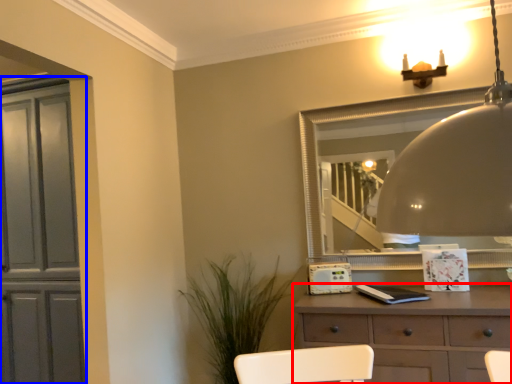
Question: Which object is closer to the camera taking this photo, chest of drawers (highlighted by a red box) or cabinetry (highlighted by a blue box)?

Choices:
 (A) chest of drawers
 (B) cabinetry

Answer: (A)